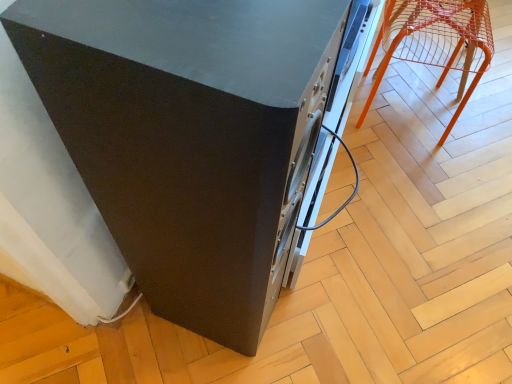
Question: Is orange wire mesh chair at upper right touching matte black speaker at center?

Choices:
 (A) no
 (B) yes

Answer: (A)

Question: Considering the relative sizes of orange wire mesh chair at upper right and matte black speaker at center in the image provided, is orange wire mesh chair at upper right taller than matte black speaker at center?

Choices:
 (A) yes
 (B) no

Answer: (B)

Question: Can you confirm if orange wire mesh chair at upper right is smaller than matte black speaker at center?

Choices:
 (A) no
 (B) yes

Answer: (B)

Question: From a real-world perspective, is orange wire mesh chair at upper right below matte black speaker at center?

Choices:
 (A) no
 (B) yes

Answer: (B)

Question: Would you consider orange wire mesh chair at upper right to be distant from matte black speaker at center?

Choices:
 (A) no
 (B) yes

Answer: (A)

Question: Is orange wire mesh chair at upper right at the right side of matte black speaker at center?

Choices:
 (A) yes
 (B) no

Answer: (A)

Question: Would you say matte black speaker at center contains orange wire mesh chair at upper right?

Choices:
 (A) yes
 (B) no

Answer: (B)

Question: From a real-world perspective, is matte black speaker at center below orange wire mesh chair at upper right?

Choices:
 (A) yes
 (B) no

Answer: (B)

Question: Is matte black speaker at center in contact with orange wire mesh chair at upper right?

Choices:
 (A) yes
 (B) no

Answer: (B)

Question: Considering the relative sizes of matte black speaker at center and orange wire mesh chair at upper right in the image provided, is matte black speaker at center smaller than orange wire mesh chair at upper right?

Choices:
 (A) yes
 (B) no

Answer: (B)

Question: Is matte black speaker at center aimed at orange wire mesh chair at upper right?

Choices:
 (A) no
 (B) yes

Answer: (A)

Question: From the image's perspective, does matte black speaker at center appear lower than orange wire mesh chair at upper right?

Choices:
 (A) no
 (B) yes

Answer: (B)

Question: From a real-world perspective, is matte black speaker at center physically located above or below orange wire mesh chair at upper right?

Choices:
 (A) below
 (B) above

Answer: (B)